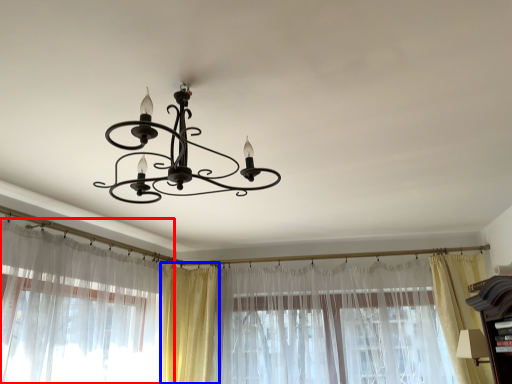
Question: Which object is closer to the camera taking this photo, curtain (highlighted by a red box) or curtain (highlighted by a blue box)?

Choices:
 (A) curtain
 (B) curtain

Answer: (A)